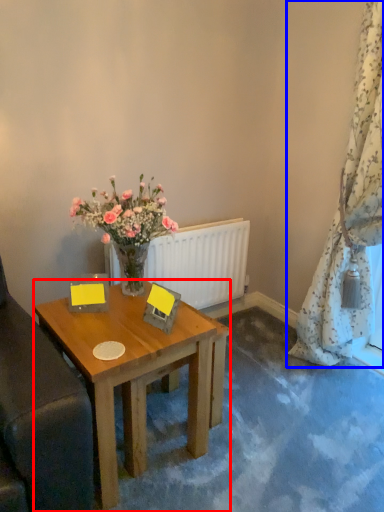
Question: Which point is further to the camera, desk (highlighted by a red box) or curtain (highlighted by a blue box)?

Choices:
 (A) desk
 (B) curtain

Answer: (B)